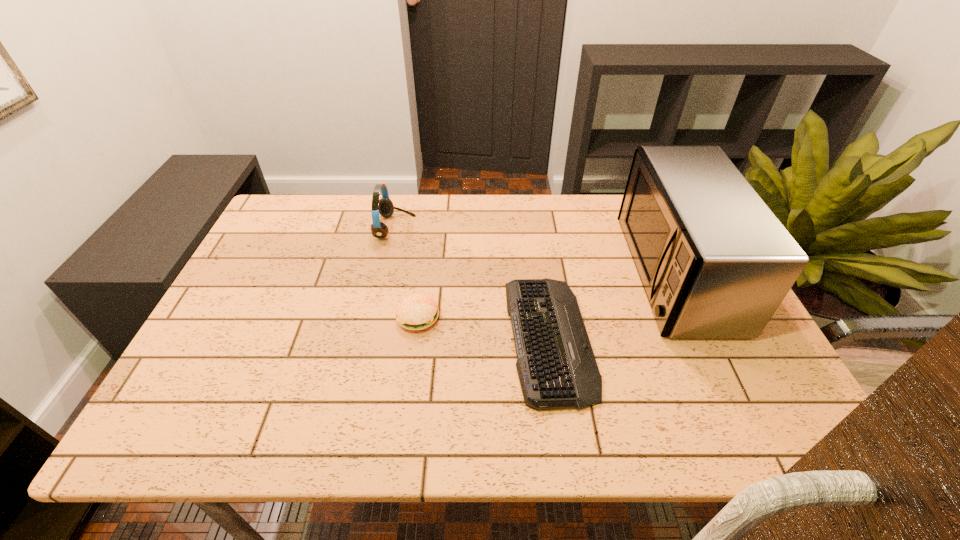
In the image, there is a desktop. In order to click on vacant space at the right edge in this screenshot , I will do `click(709, 362)`.

Where is `vacant space at the far left corner`? The width and height of the screenshot is (960, 540). vacant space at the far left corner is located at coordinates (323, 215).

The width and height of the screenshot is (960, 540). Find the location of `free spot between the second tallest object and the patty`. free spot between the second tallest object and the patty is located at coordinates (407, 273).

This screenshot has width=960, height=540. In order to click on empty space between the shortest object and the microwave_oven in this screenshot , I will do `click(612, 305)`.

Identify the location of vacant region between the rightmost object and the headset. (535, 250).

Identify the location of empty space between the headset and the shortest object. (472, 283).

Locate an element on the screen. This screenshot has height=540, width=960. unoccupied area between the headset and the computer keyboard is located at coordinates (472, 283).

Find the location of `empty space that is in between the second tallest object and the shortest object`. empty space that is in between the second tallest object and the shortest object is located at coordinates (472, 283).

Where is `free space between the patty and the third shortest object`? This screenshot has width=960, height=540. free space between the patty and the third shortest object is located at coordinates (407, 273).

The height and width of the screenshot is (540, 960). Find the location of `vacant space that's between the microwave_oven and the third shortest object`. vacant space that's between the microwave_oven and the third shortest object is located at coordinates (535, 250).